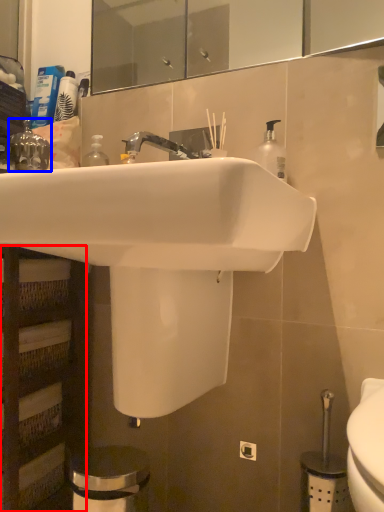
Question: Which of the following is the closest to the observer, shelf (highlighted by a red box) or plumbing fixture (highlighted by a blue box)?

Choices:
 (A) shelf
 (B) plumbing fixture

Answer: (A)